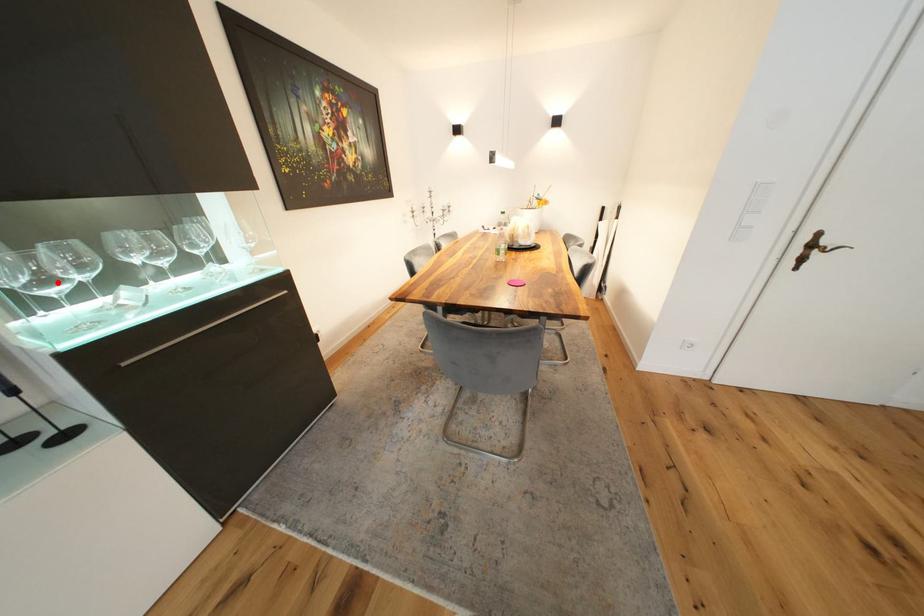
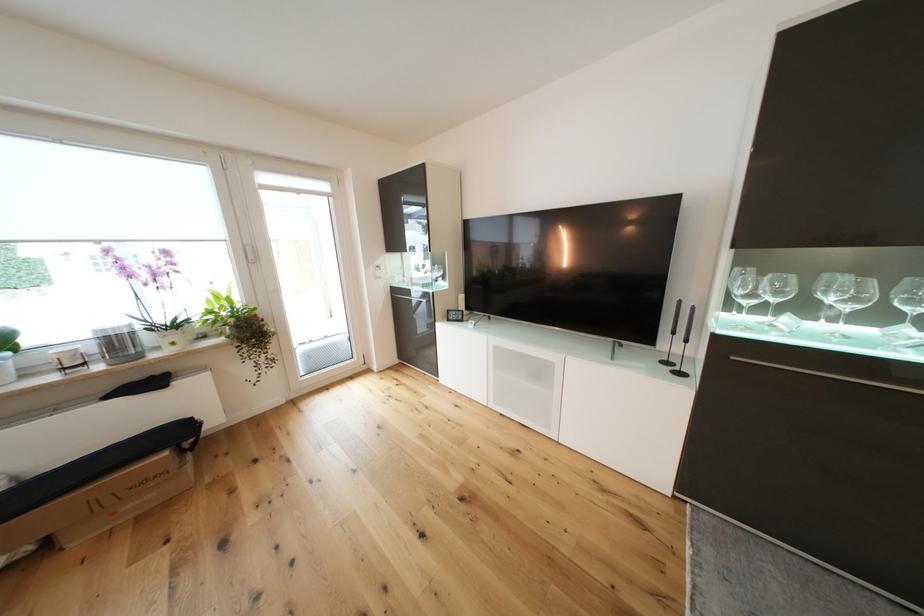
Locate, in the second image, the point that corresponds to the highlighted location in the first image.

(758, 297)